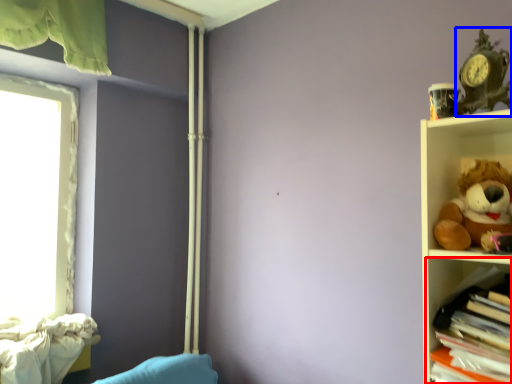
Question: Which of the following is the farthest to the observer, shelf (highlighted by a red box) or toy (highlighted by a blue box)?

Choices:
 (A) shelf
 (B) toy

Answer: (B)